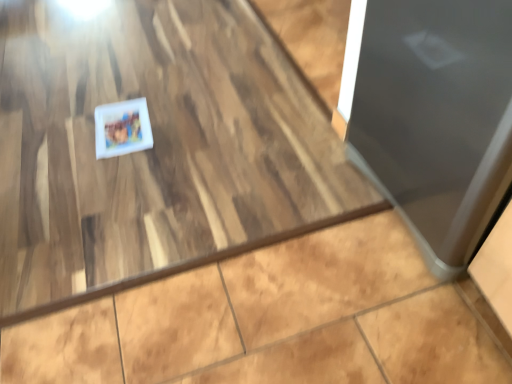
Locate an element on the screen. This screenshot has width=512, height=384. free spot above white matte postcard at center (from a real-world perspective) is located at coordinates (120, 125).